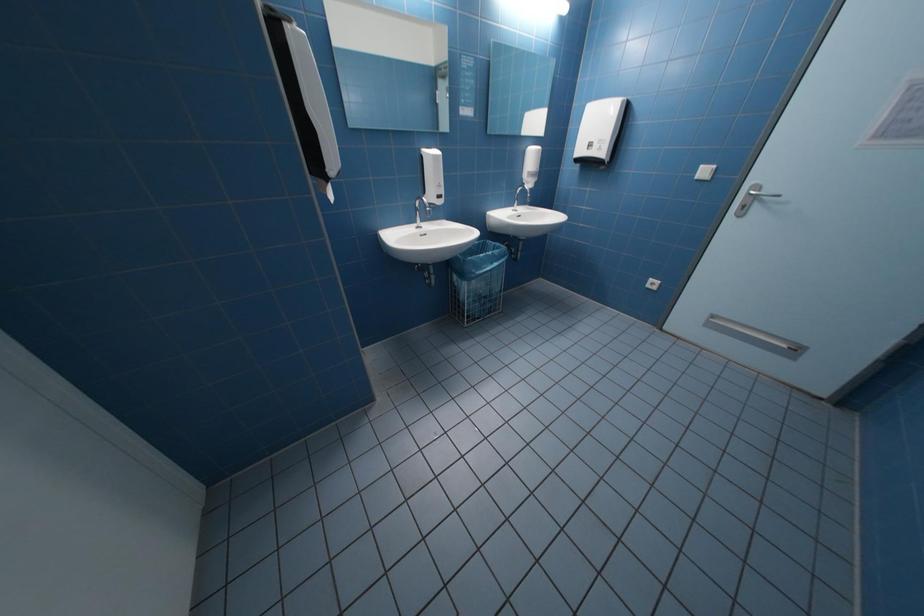
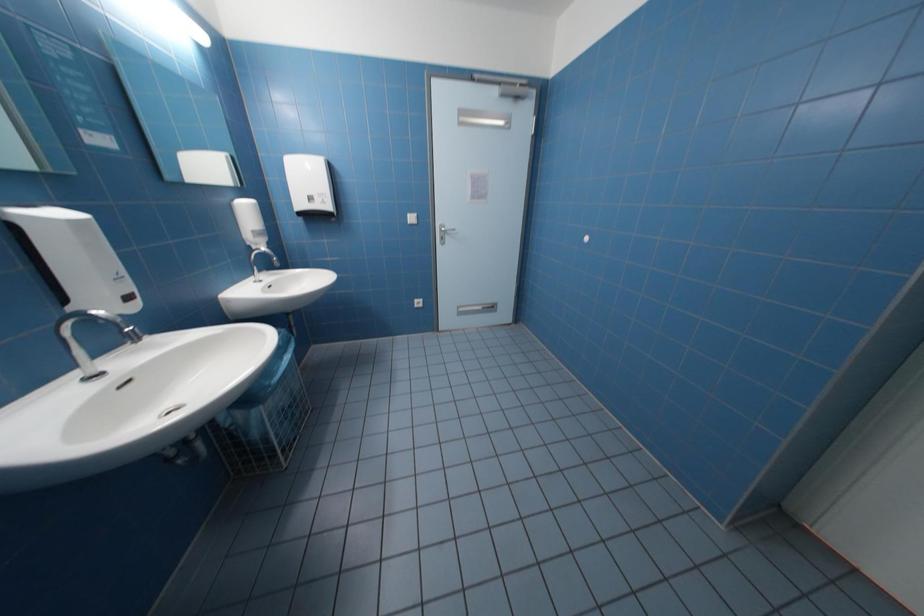
Question: The images are taken continuously from a first-person perspective. In which direction is your viewpoint rotating?

Choices:
 (A) Left
 (B) Right
 (C) Up
 (D) Down

Answer: (B)